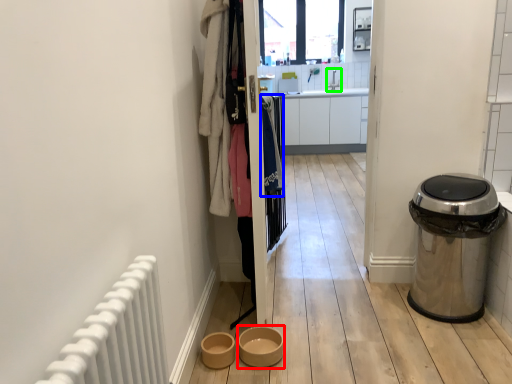
Question: Which object is the farthest from toilet bowl (highlighted by a red box)? Choose among these: clothing (highlighted by a blue box) or sink (highlighted by a green box).

Choices:
 (A) clothing
 (B) sink

Answer: (B)